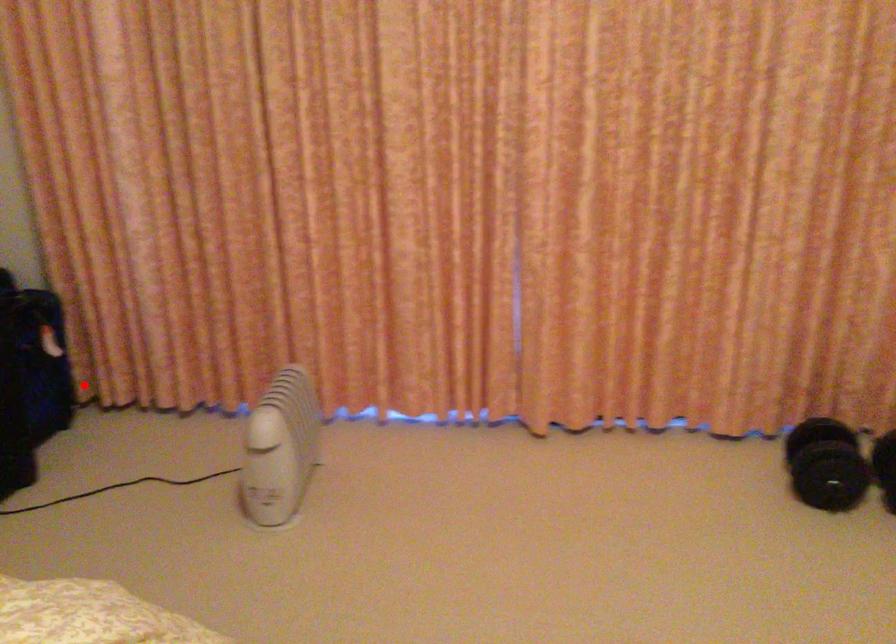
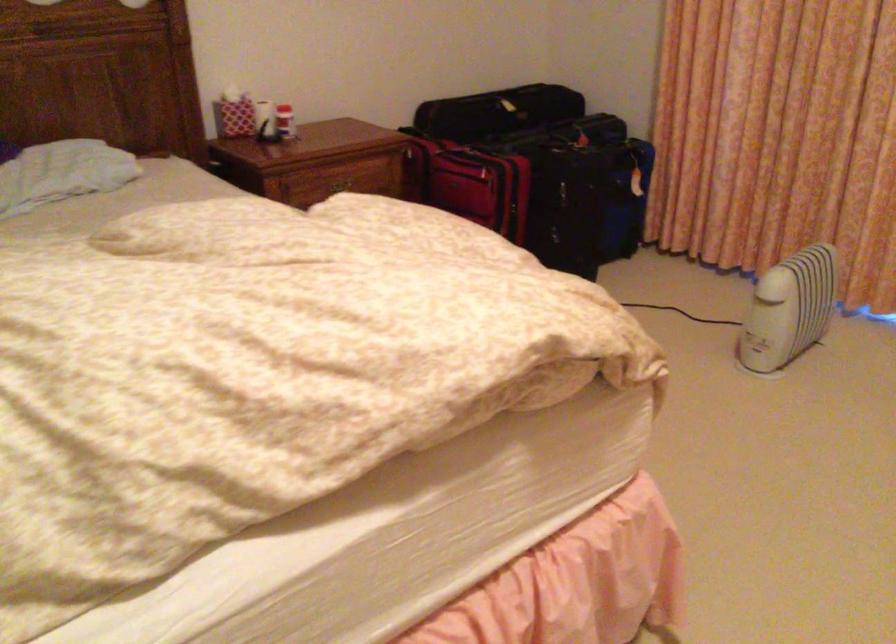
Where in the second image is the point corresponding to the highlighted location from the first image?

(649, 223)